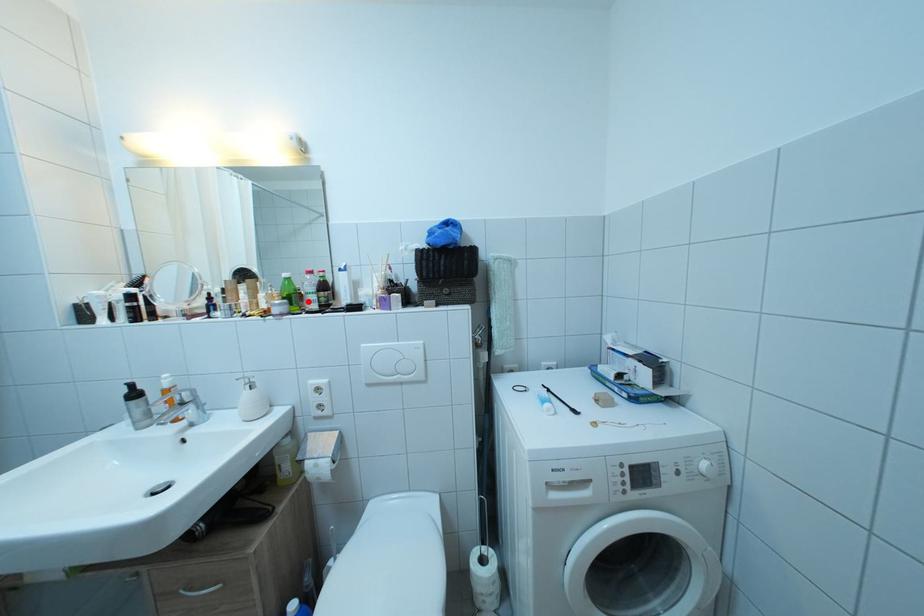
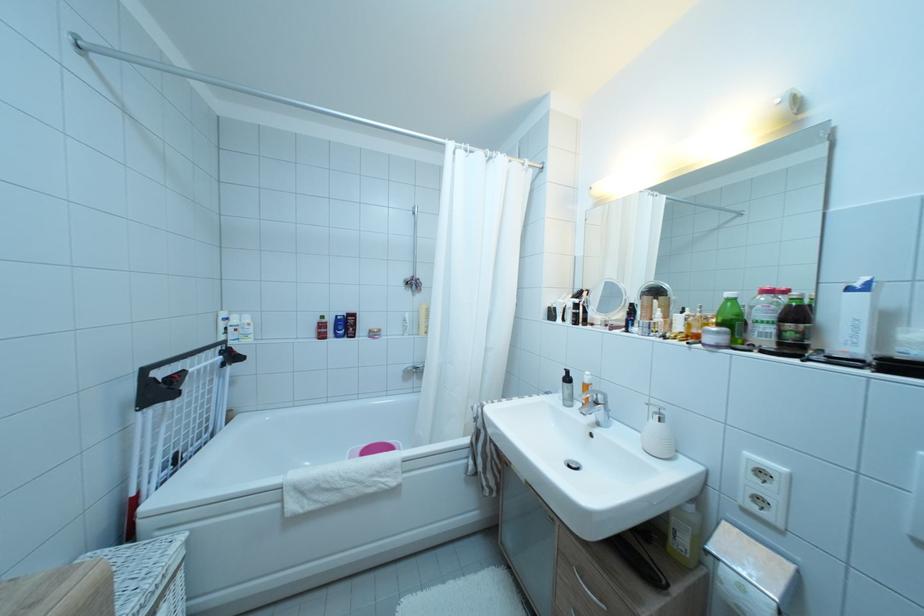
Question: I am providing you with two images of the same scene from different viewpoints. A red point is marked on the first image. Is the red point's position out of view in image 2?

Choices:
 (A) Yes
 (B) No

Answer: (B)